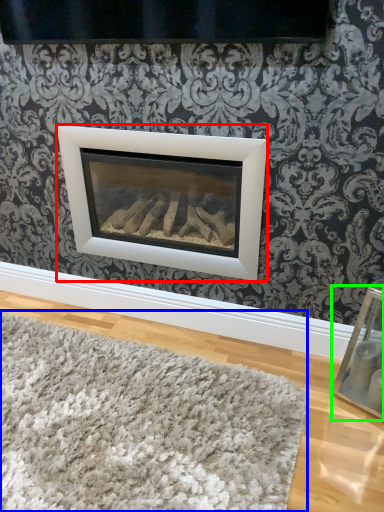
Question: Considering the real-world distances, which object is closest to fireplace (highlighted by a red box)? mat (highlighted by a blue box) or picture frame (highlighted by a green box).

Choices:
 (A) mat
 (B) picture frame

Answer: (A)